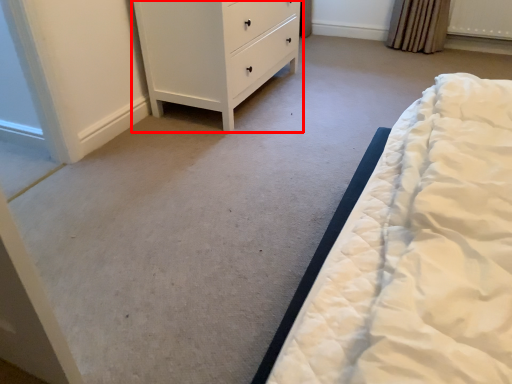
Question: Considering the relative positions of chest of drawers (annotated by the red box) and radiator in the image provided, where is chest of drawers (annotated by the red box) located with respect to the staircase?

Choices:
 (A) left
 (B) right

Answer: (A)